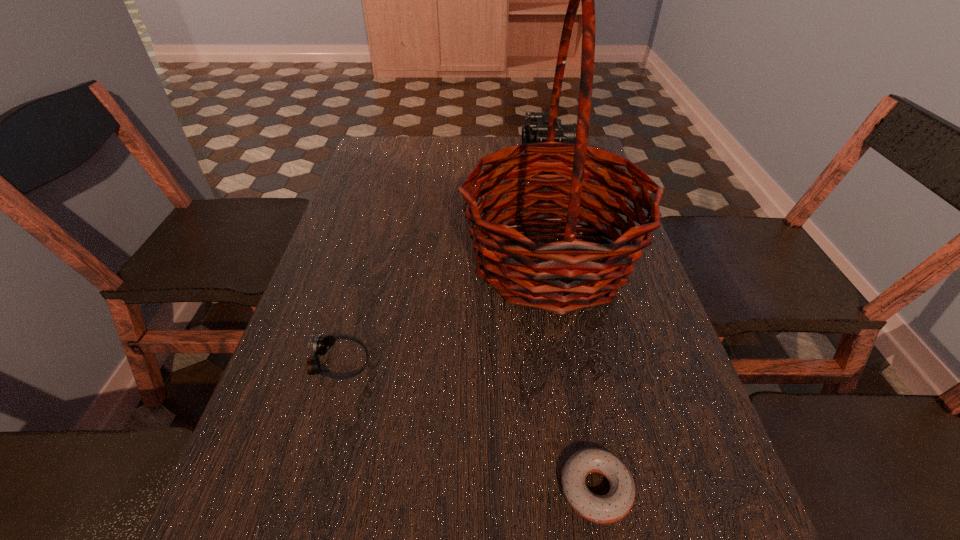
This screenshot has height=540, width=960. Identify the location of free space in the image that satisfies the following two spatial constraints: 1. through the lenses of the doughnut; 2. on the left side of the leftmost object. (303, 489).

Identify the location of vacant point that satisfies the following two spatial constraints: 1. through the lenses of the leftmost object; 2. on the right side of the doughnut. This screenshot has height=540, width=960. (303, 489).

At what (x,y) coordinates should I click in order to perform the action: click on vacant space that satisfies the following two spatial constraints: 1. through the lenses of the goggles; 2. on the left side of the nearest object. Please return your answer as a coordinate pair (x, y). The width and height of the screenshot is (960, 540). Looking at the image, I should click on (303, 489).